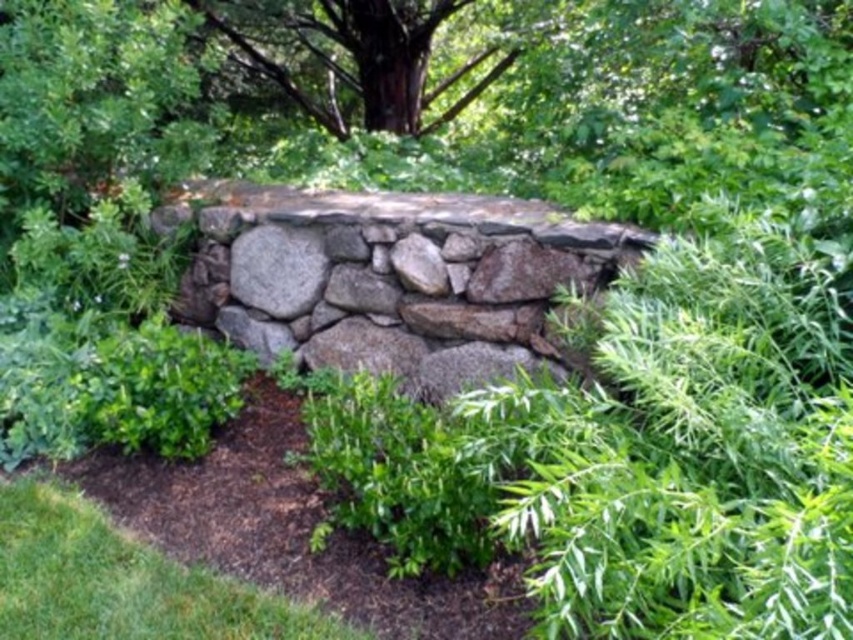
Where is `green leafy bush at center`? green leafy bush at center is located at coordinates (692, 444).

Is green leafy bush at center positioned in front of natural gray stone wall at center?

Yes, green leafy bush at center is closer to the viewer.

Describe the element at coordinates (692, 444) in the screenshot. The height and width of the screenshot is (640, 853). I see `green leafy bush at center` at that location.

Identify the location of green leafy bush at center. The height and width of the screenshot is (640, 853). click(x=692, y=444).